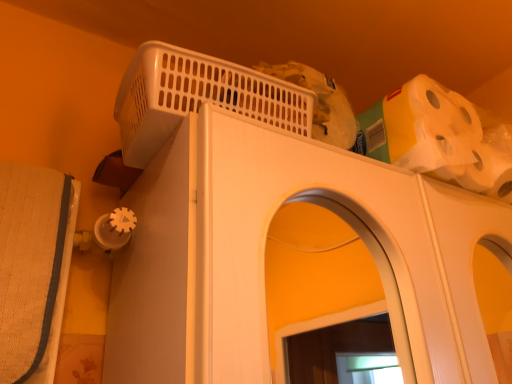
Question: Is white plastic basket at upper center further to the viewer compared to white matte toilet paper at upper right?

Choices:
 (A) yes
 (B) no

Answer: (B)

Question: Is white plastic basket at upper center bigger than white matte toilet paper at upper right?

Choices:
 (A) no
 (B) yes

Answer: (B)

Question: Is white plastic basket at upper center looking in the opposite direction of white matte toilet paper at upper right?

Choices:
 (A) yes
 (B) no

Answer: (B)

Question: Is white plastic basket at upper center positioned before white matte toilet paper at upper right?

Choices:
 (A) no
 (B) yes

Answer: (B)

Question: Can white matte toilet paper at upper right be found inside white plastic basket at upper center?

Choices:
 (A) yes
 (B) no

Answer: (B)

Question: From a real-world perspective, is white plastic basket at upper center on white matte toilet paper at upper right?

Choices:
 (A) no
 (B) yes

Answer: (A)

Question: From the image's perspective, is white matte toilet paper at upper right on white plastic basket at upper center?

Choices:
 (A) no
 (B) yes

Answer: (A)

Question: Is white matte toilet paper at upper right not within white plastic basket at upper center?

Choices:
 (A) no
 (B) yes

Answer: (B)

Question: From a real-world perspective, is white matte toilet paper at upper right positioned under white plastic basket at upper center based on gravity?

Choices:
 (A) yes
 (B) no

Answer: (B)

Question: Is white matte toilet paper at upper right in contact with white plastic basket at upper center?

Choices:
 (A) no
 (B) yes

Answer: (A)

Question: Is white matte toilet paper at upper right to the right of white plastic basket at upper center from the viewer's perspective?

Choices:
 (A) yes
 (B) no

Answer: (A)

Question: Considering the relative sizes of white matte toilet paper at upper right and white plastic basket at upper center in the image provided, is white matte toilet paper at upper right taller than white plastic basket at upper center?

Choices:
 (A) yes
 (B) no

Answer: (A)

Question: From the image's perspective, is white matte toilet paper at upper right on white plastic basket at upper center?

Choices:
 (A) yes
 (B) no

Answer: (A)